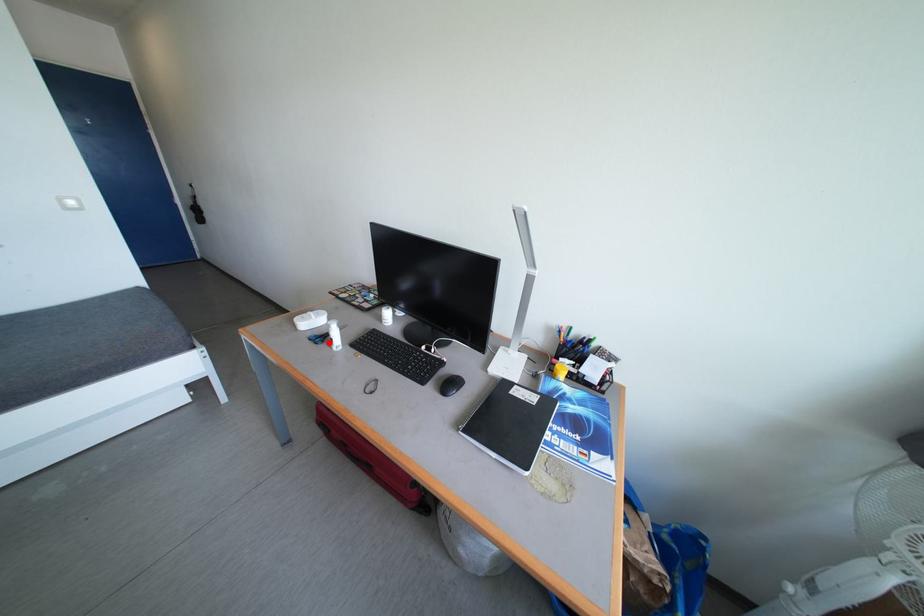
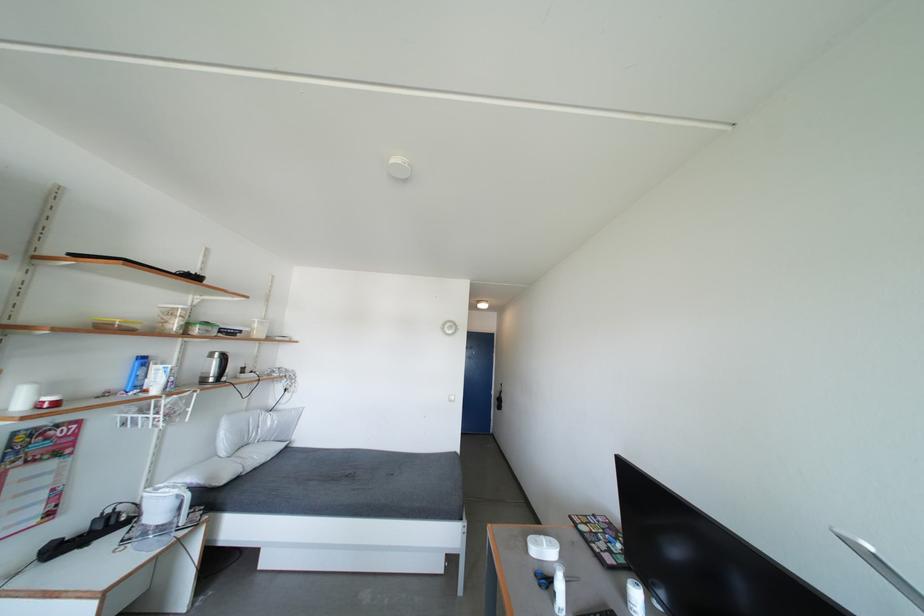
In the second image, find the point that corresponds to the highlighted location in the first image.

(553, 588)